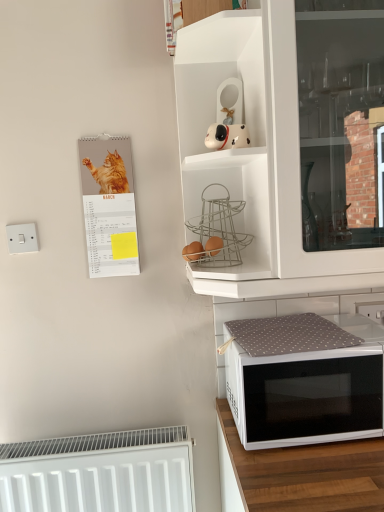
Find the location of a particular element. The image size is (384, 512). vacant space situated above white fabric-covered microwave at lower right (from a real-world perspective) is located at coordinates (291, 328).